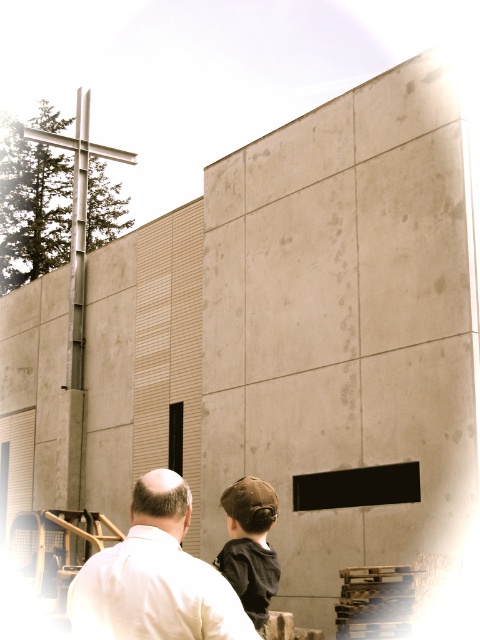
Question: Can you confirm if white matte shirt at lower left is bigger than brown fabric cap at center?

Choices:
 (A) yes
 (B) no

Answer: (A)

Question: Does white matte shirt at lower left appear on the right side of brown fabric cap at center?

Choices:
 (A) no
 (B) yes

Answer: (A)

Question: Which object appears closest to the camera in this image?

Choices:
 (A) brown fabric cap at center
 (B) white matte shirt at lower left

Answer: (B)

Question: Which point is closer to the camera taking this photo?

Choices:
 (A) (222, 502)
 (B) (144, 504)

Answer: (B)

Question: Is white matte shirt at lower left behind brown fabric cap at center?

Choices:
 (A) no
 (B) yes

Answer: (A)